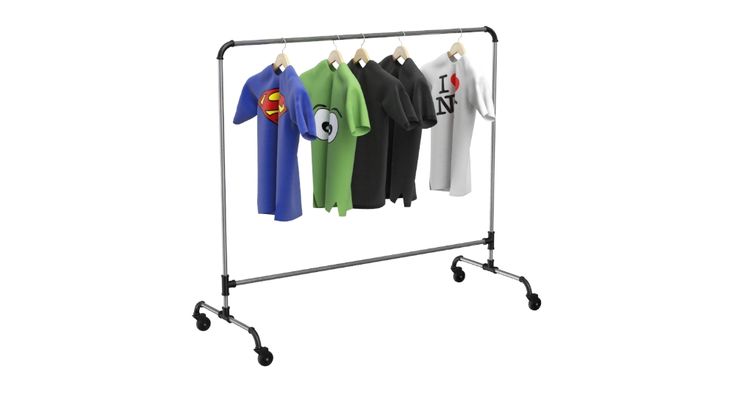
Where is `caster`? caster is located at coordinates (267, 358), (204, 323), (534, 305), (461, 274).